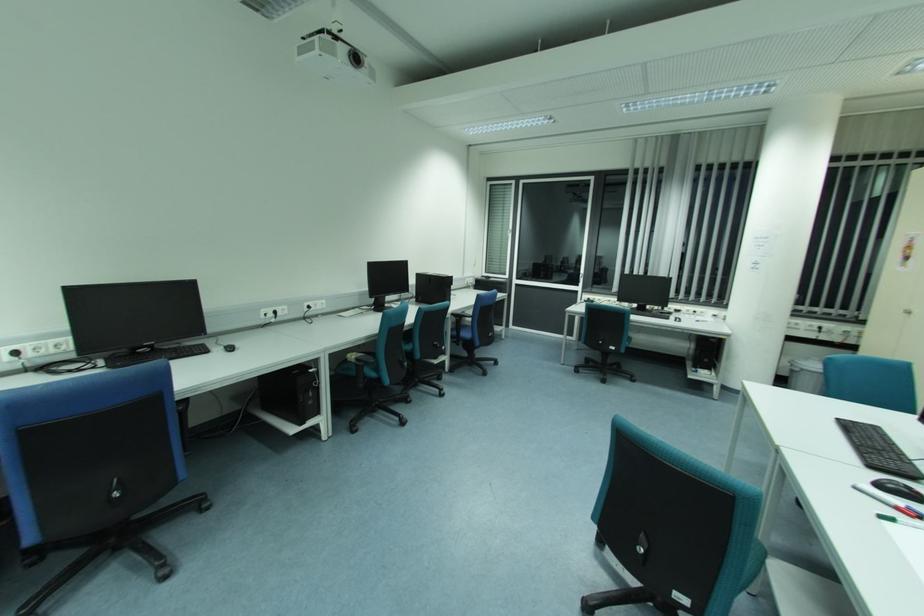
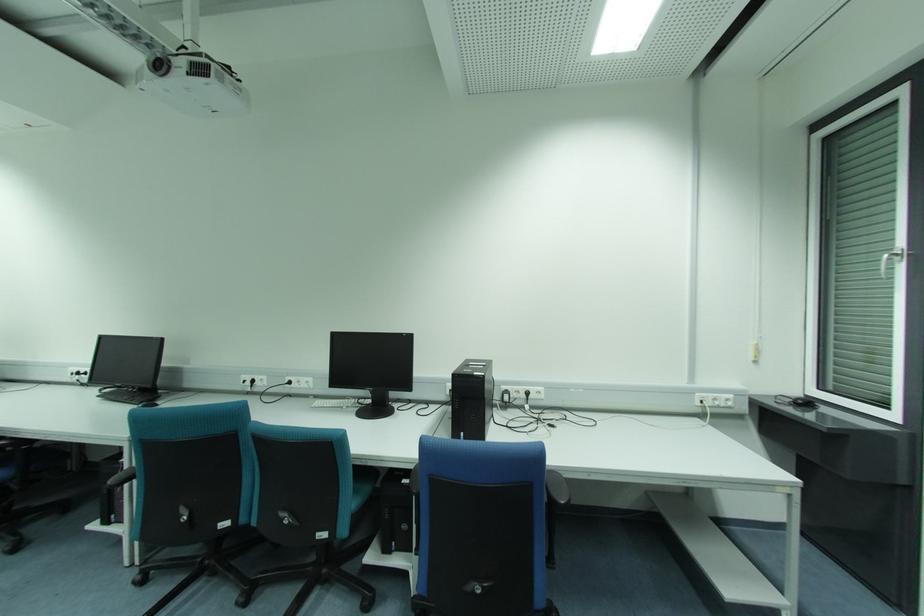
The point at (276, 313) is marked in the first image. Where is the corresponding point in the second image?

(253, 381)